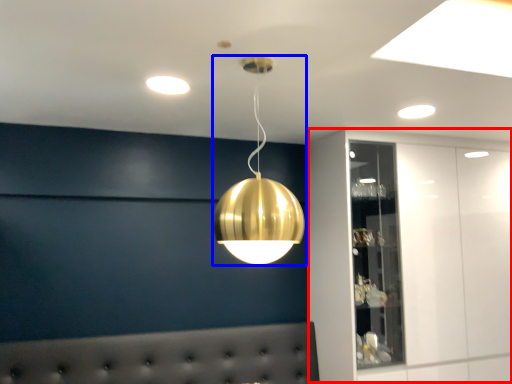
Question: Which point is closer to the camera, dresser (highlighted by a red box) or lamp (highlighted by a blue box)?

Choices:
 (A) dresser
 (B) lamp

Answer: (B)